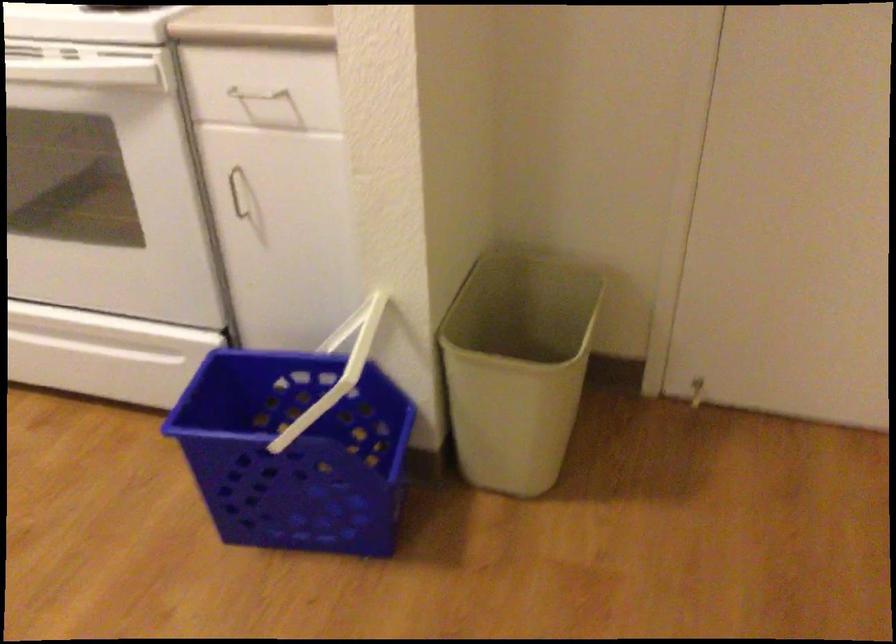
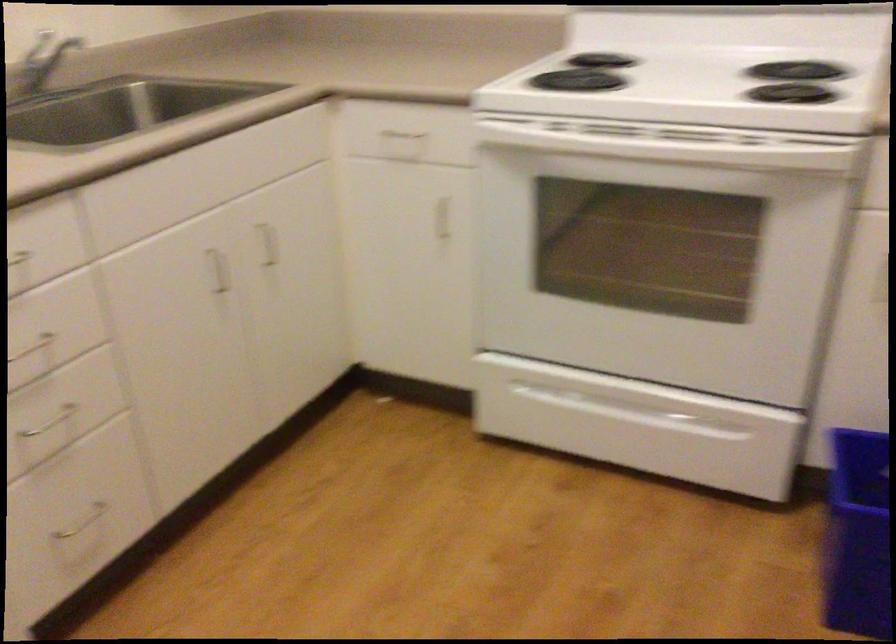
Question: The images are taken continuously from a first-person perspective. In which direction are you moving?

Choices:
 (A) Left
 (B) Right
 (C) Forward
 (D) Backward

Answer: (A)